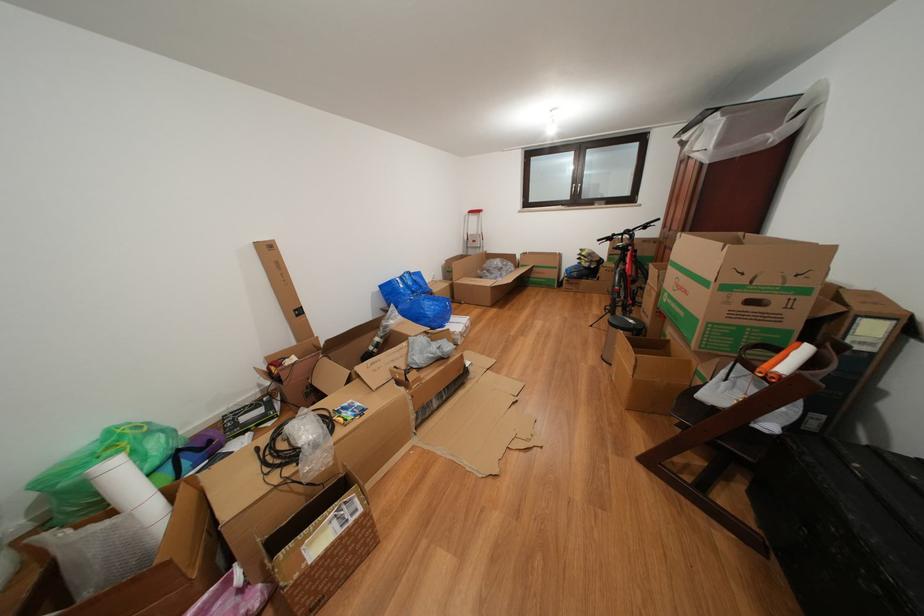
Which object does [775,359] point to?

It corresponds to the orange paint roller in the image.